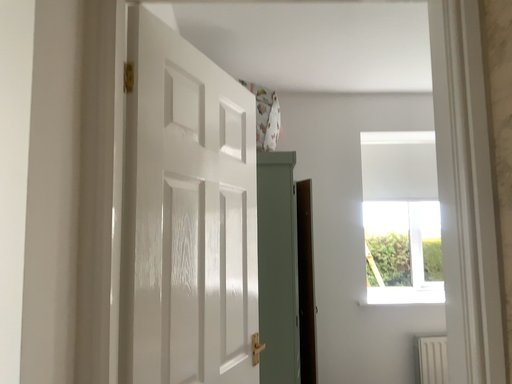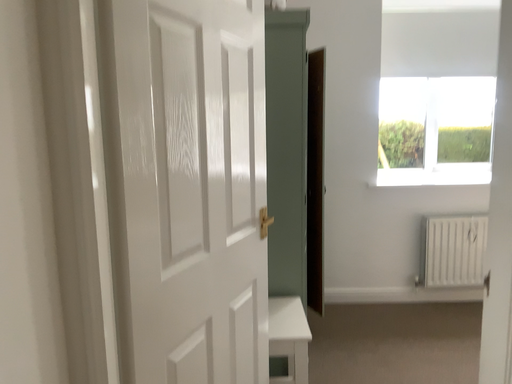
Question: How did the camera likely rotate when shooting the video?

Choices:
 (A) rotated upward
 (B) rotated downward

Answer: (B)